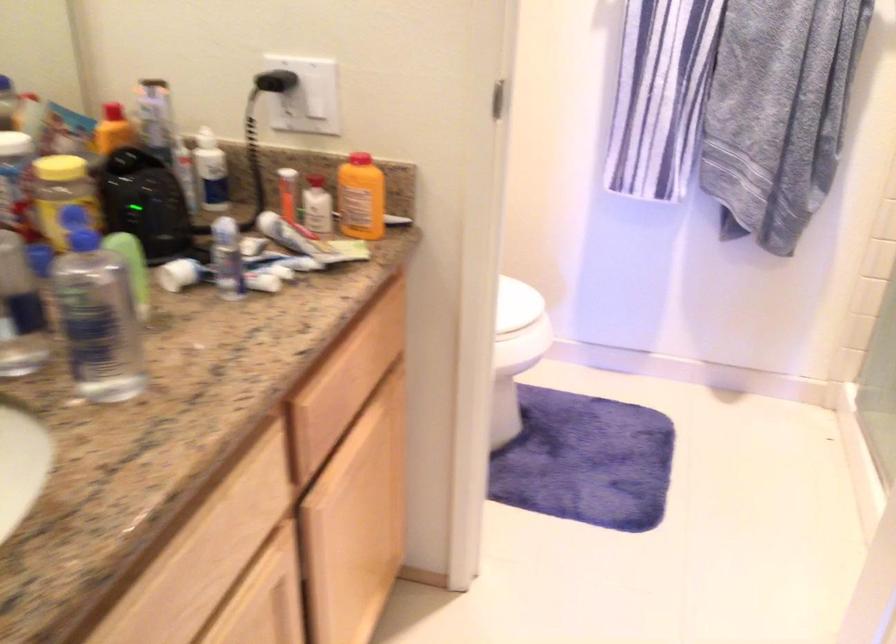
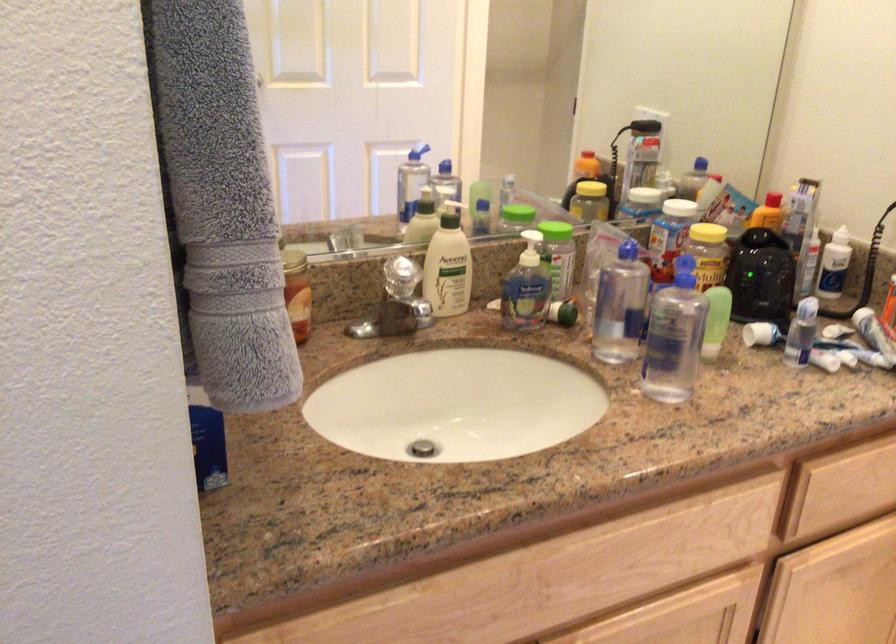
In the second image, find the point that corresponds to pixel 263 254 in the first image.

(839, 339)